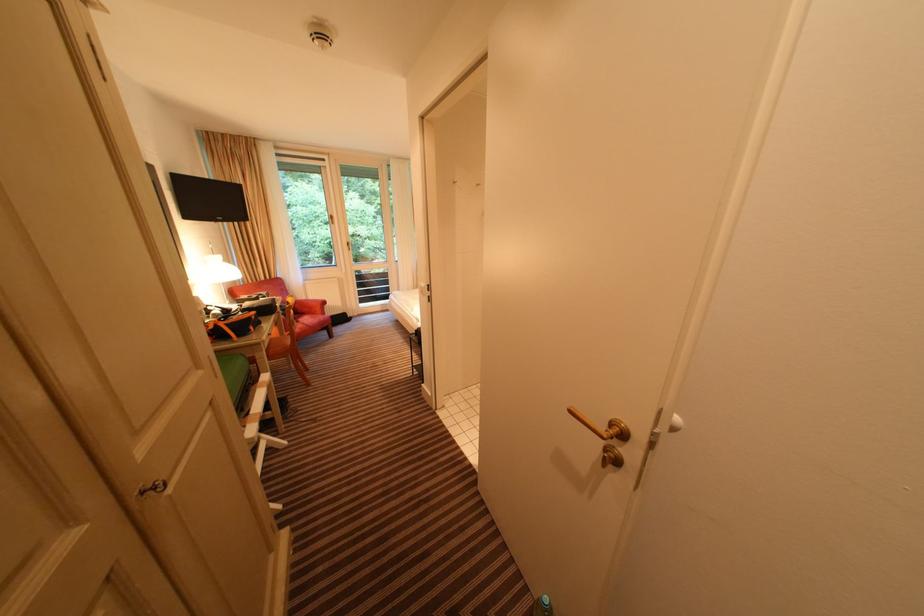
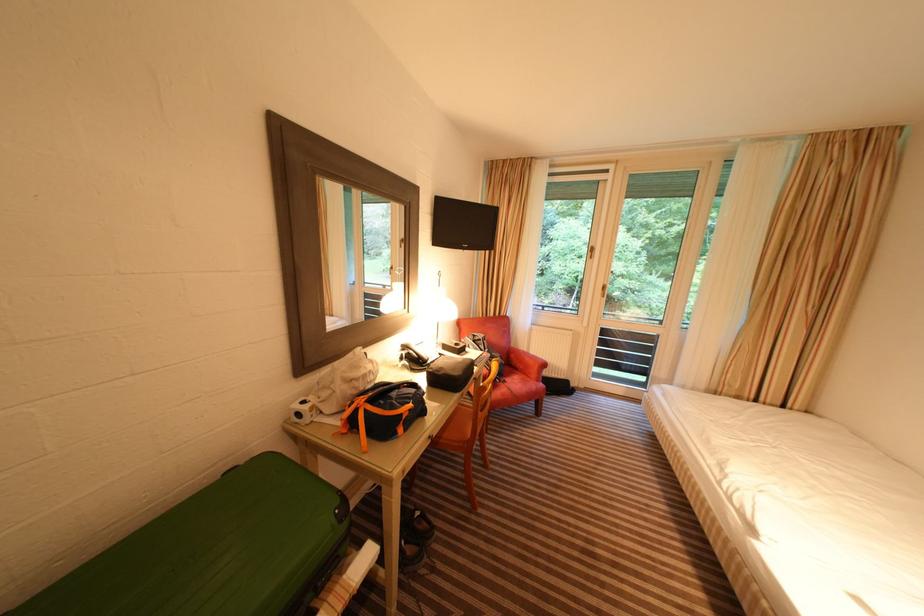
The point at (334, 222) is marked in the first image. Where is the corresponding point in the second image?

(590, 254)